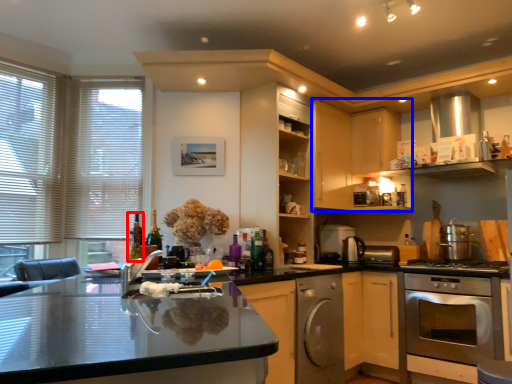
Question: Which object appears closest to the camera in this image, wine bottle (highlighted by a red box) or cabinetry (highlighted by a blue box)?

Choices:
 (A) wine bottle
 (B) cabinetry

Answer: (A)